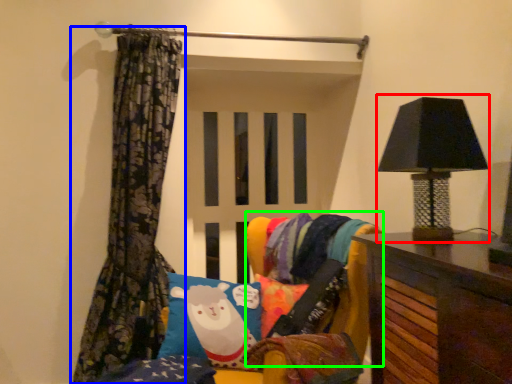
Question: Based on their relative distances, which object is farther from table lamp (highlighted by a red box)? Choose from curtain (highlighted by a blue box) and bean bag chair (highlighted by a green box).

Choices:
 (A) curtain
 (B) bean bag chair

Answer: (A)